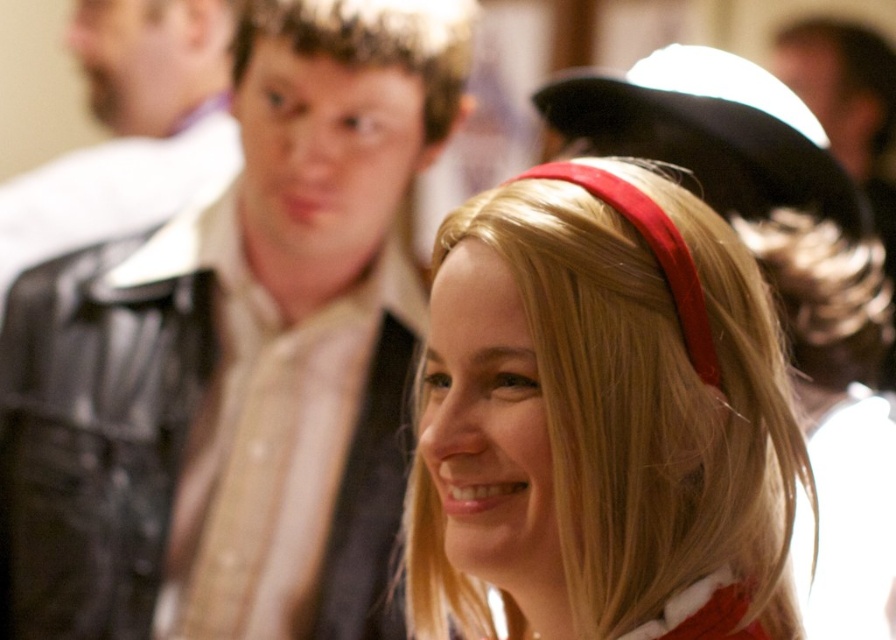
What do you see at coordinates (238, 358) in the screenshot?
I see `leather jacket at upper left` at bounding box center [238, 358].

Identify the location of leather jacket at upper left. (238, 358).

Is point (306, 273) closer to viewer compared to point (110, 173)?

Yes, point (306, 273) is closer to viewer.

The width and height of the screenshot is (896, 640). What are the coordinates of `leather jacket at upper left` in the screenshot? It's located at (238, 358).

Does matte red headband at center appear on the left side of leather jacket at left?

In fact, matte red headband at center is to the right of leather jacket at left.

Who is positioned more to the left, matte red headband at center or leather jacket at left?

From the viewer's perspective, leather jacket at left appears more on the left side.

Image resolution: width=896 pixels, height=640 pixels. Describe the element at coordinates (600, 422) in the screenshot. I see `matte red headband at center` at that location.

I want to click on matte red headband at center, so click(x=600, y=422).

Locate an element on the screen. The width and height of the screenshot is (896, 640). leather jacket at upper left is located at coordinates (238, 358).

Is leather jacket at upper left bigger than matte red headband at center?

Correct, leather jacket at upper left is larger in size than matte red headband at center.

I want to click on leather jacket at upper left, so click(238, 358).